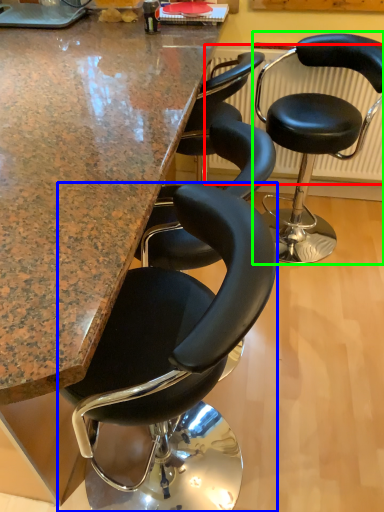
Question: Which object is positioned farthest from radiator (highlighted by a red box)? Select from chair (highlighted by a blue box) and chair (highlighted by a green box).

Choices:
 (A) chair
 (B) chair

Answer: (A)